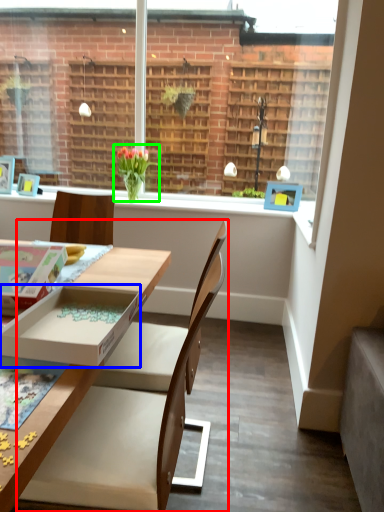
Question: Based on their relative distances, which object is farther from chair (highlighted by a red box)? Choose from box (highlighted by a blue box) and houseplant (highlighted by a green box).

Choices:
 (A) box
 (B) houseplant

Answer: (B)